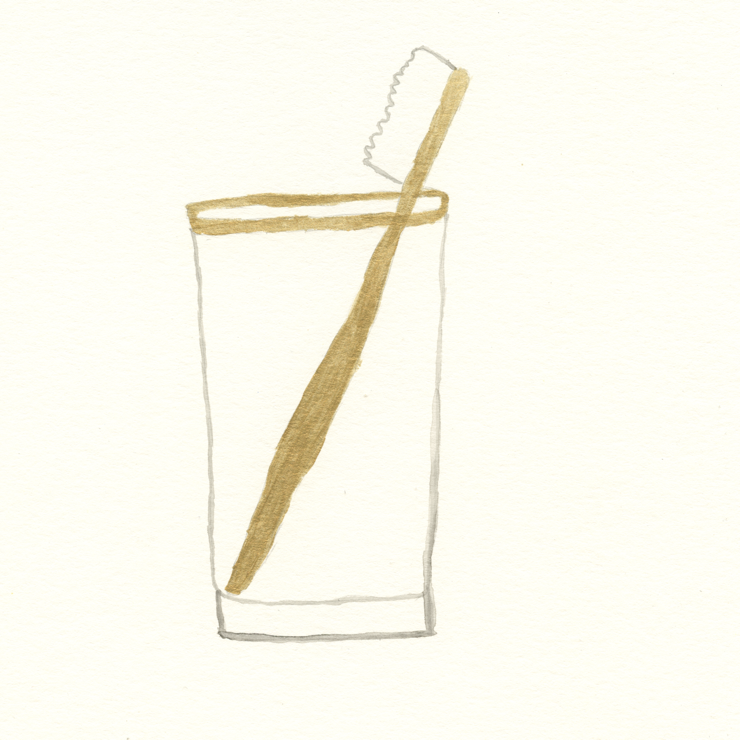
What are the coordinates of `handle of toothbrush` in the screenshot? It's located at (316, 414).